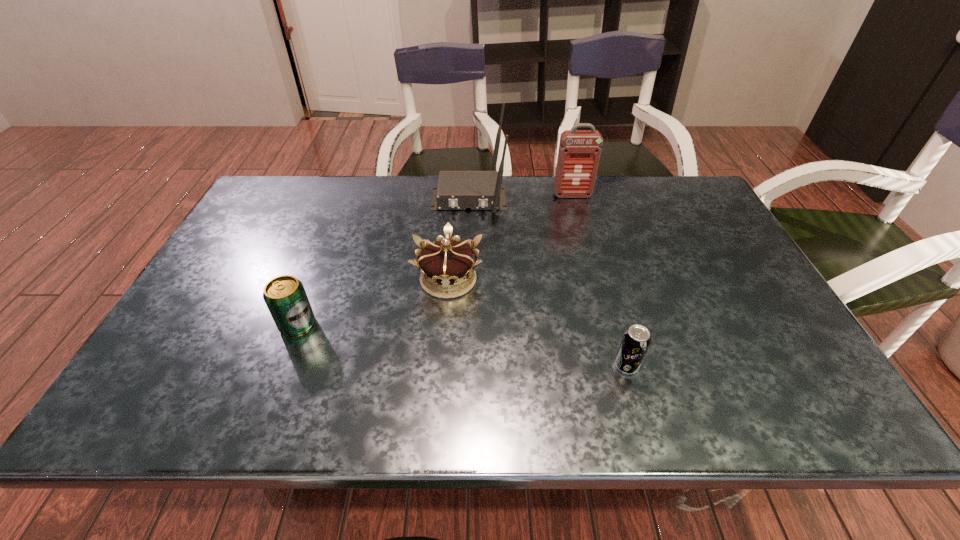
Find the location of a particular element. The width and height of the screenshot is (960, 540). free area in between the fourth farthest object and the crown is located at coordinates (372, 302).

The height and width of the screenshot is (540, 960). I want to click on free space between the crown and the first-aid kit, so click(511, 237).

This screenshot has width=960, height=540. I want to click on empty location between the crown and the first-aid kit, so click(511, 237).

You are a GUI agent. You are given a task and a screenshot of the screen. Output one action in this format:
    pyautogui.click(x=<x>, y=<y>)
    Task: Click on the vacant space that is in between the first-aid kit and the crown
    This screenshot has width=960, height=540.
    Given the screenshot: What is the action you would take?
    pyautogui.click(x=511, y=237)

Image resolution: width=960 pixels, height=540 pixels. I want to click on vacant point located between the router and the first-aid kit, so click(520, 197).

Where is `vacant space that is in between the leftmost object and the soda can`? This screenshot has width=960, height=540. vacant space that is in between the leftmost object and the soda can is located at coordinates (462, 345).

At what (x,y) coordinates should I click in order to perform the action: click on free spot between the nearest object and the first-aid kit. Please return your answer as a coordinate pair (x, y). This screenshot has height=540, width=960. Looking at the image, I should click on (599, 280).

The width and height of the screenshot is (960, 540). Find the location of `empty space that is in between the second nearest object and the router`. empty space that is in between the second nearest object and the router is located at coordinates (383, 261).

This screenshot has width=960, height=540. In order to click on object identified as the second closest to the nearest object in this screenshot , I will do `click(457, 190)`.

This screenshot has width=960, height=540. Find the location of `object that can be found as the third closest to the beer can`. object that can be found as the third closest to the beer can is located at coordinates click(636, 340).